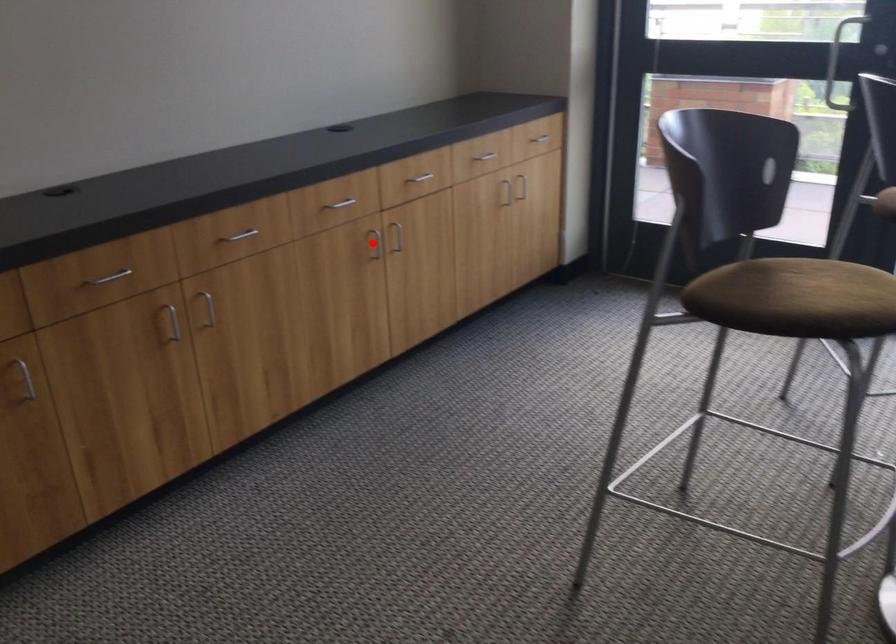
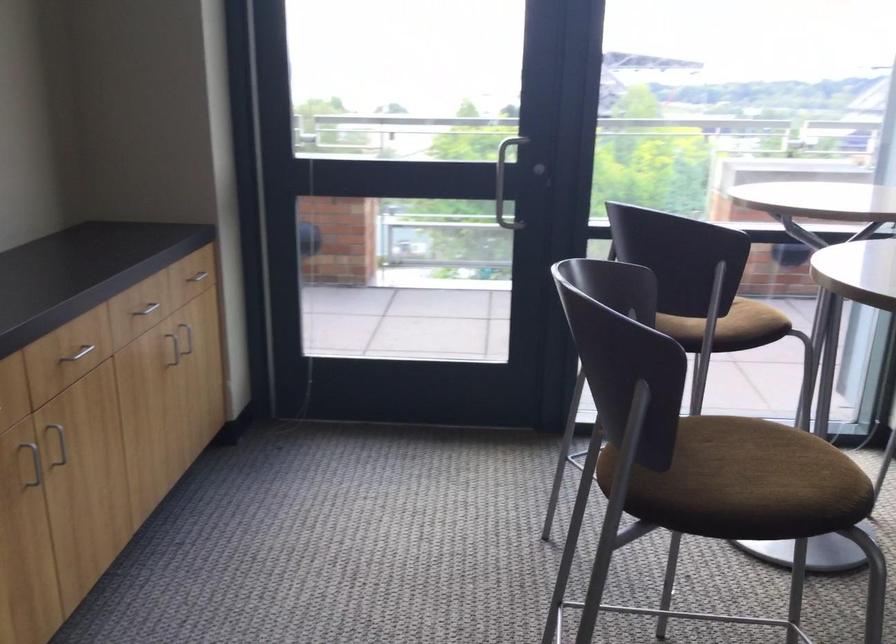
In the second image, find the point that corresponds to the highlighted location in the first image.

(36, 465)